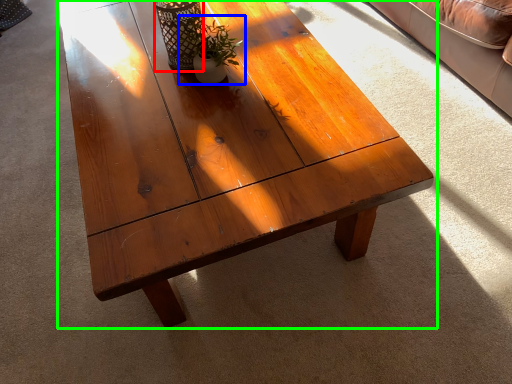
Question: Considering the real-world distances, which object is farthest from glass vase (highlighted by a red box)? houseplant (highlighted by a blue box) or coffee table (highlighted by a green box)?

Choices:
 (A) houseplant
 (B) coffee table

Answer: (B)